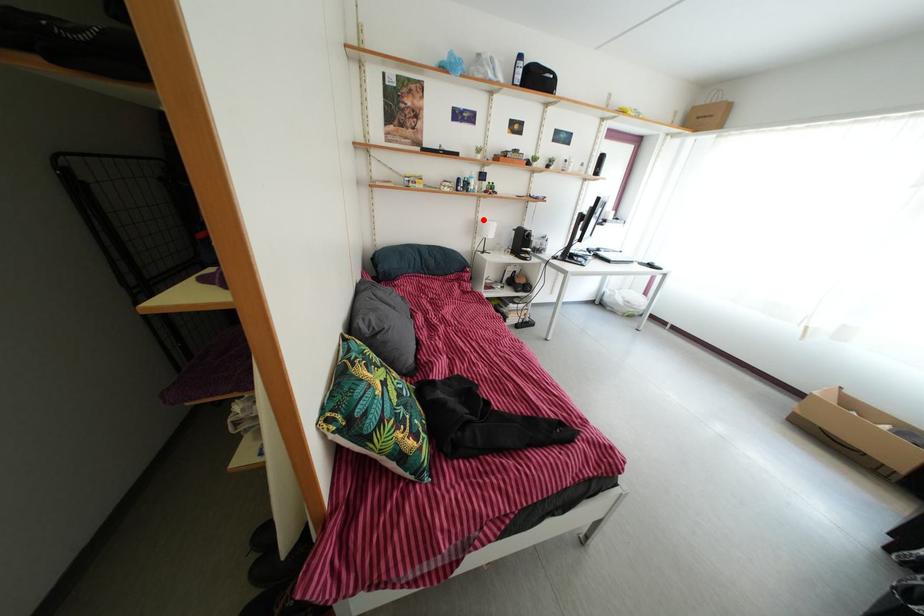
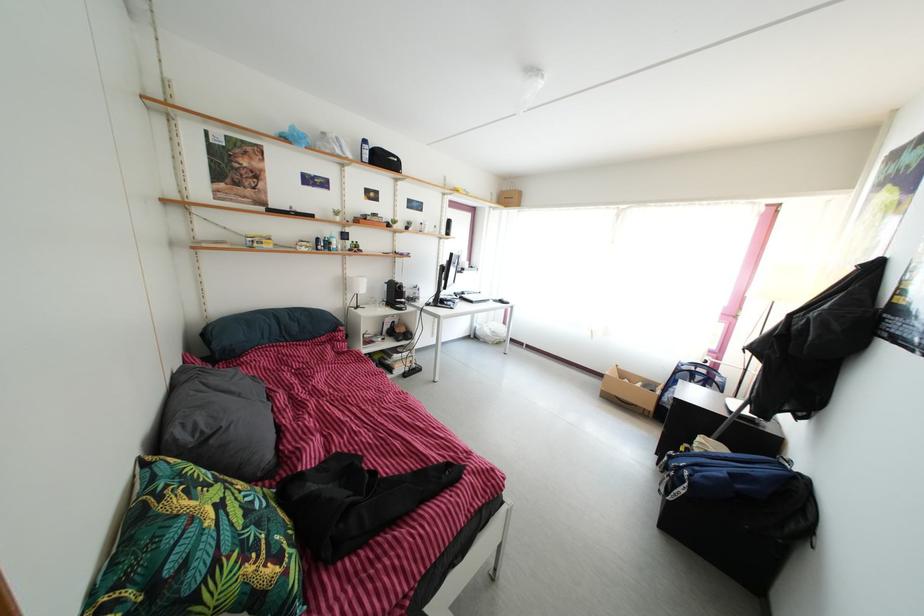
Question: A red point is marked in image1. In image2, is the corresponding 3D point closer to the camera or farther? Reply with the corresponding letter.

Choices:
 (A) The corresponding 3D point is closer.
 (B) The corresponding 3D point is farther.

Answer: (B)